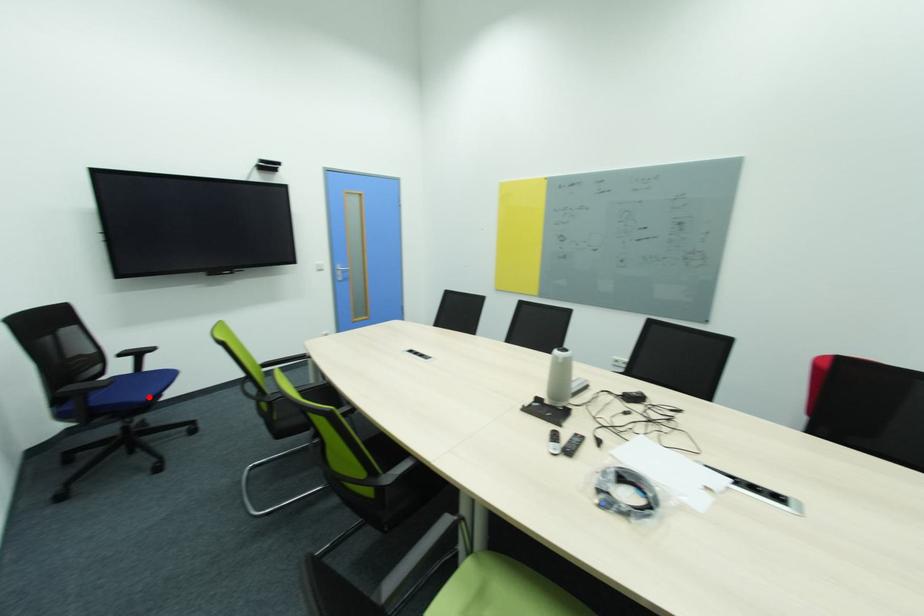
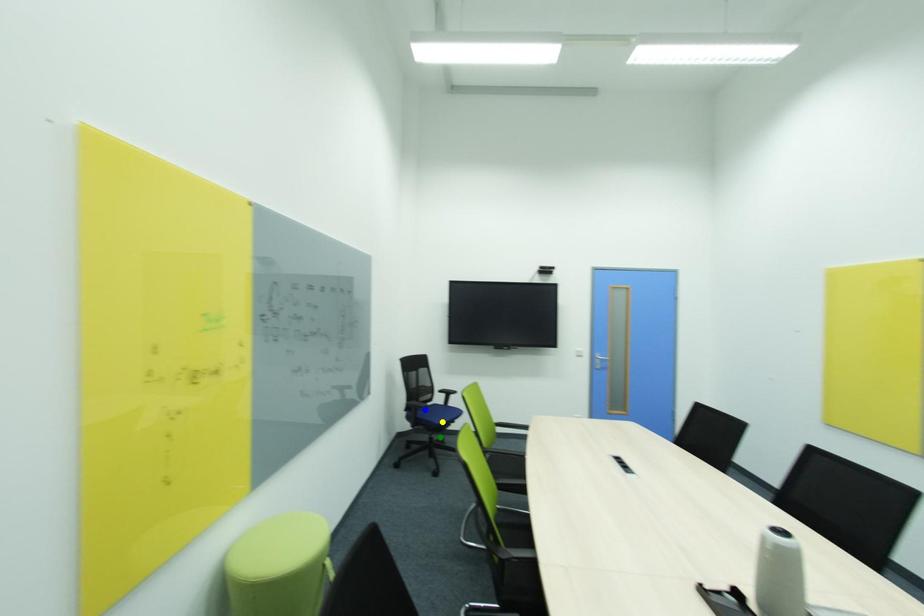
Question: I am providing you with two images of the same scene from different viewpoints. A red point is marked on the first image. You are given multiple points on the second image. Can you choose the point in image 2 that corresponds to the point in image 1?

Choices:
 (A) green point
 (B) blue point
 (C) yellow point

Answer: (C)